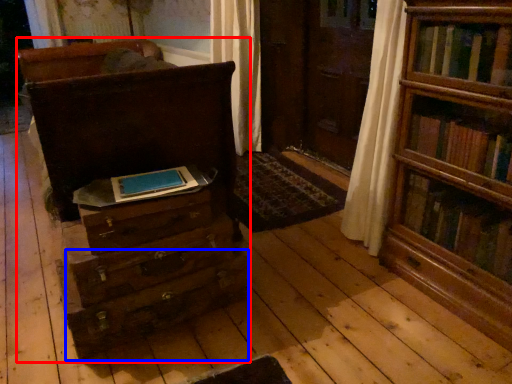
Question: Which object appears farthest to the camera in this image, chest of drawers (highlighted by a red box) or drawer (highlighted by a blue box)?

Choices:
 (A) chest of drawers
 (B) drawer

Answer: (B)